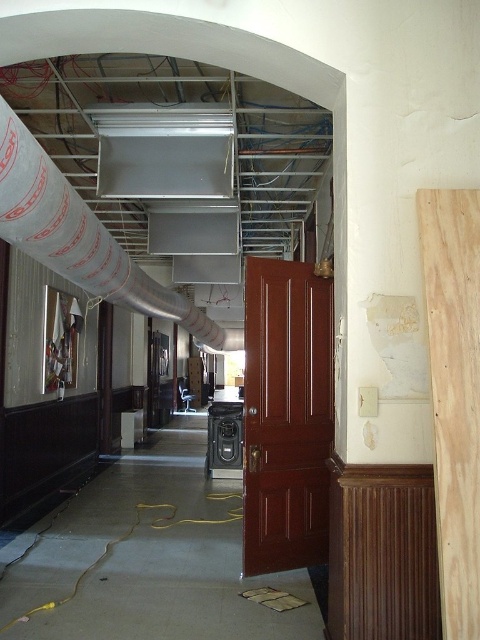
Which is below, yellow rubber hose at center or white plastic pipe at upper left?

yellow rubber hose at center

How distant is yellow rubber hose at center from white plastic pipe at upper left?

8.43 feet

Does point (167, 493) come farther from viewer compared to point (208, 337)?

No, (167, 493) is closer to viewer.

What are the coordinates of `yellow rubber hose at center` in the screenshot? It's located at (147, 557).

Which of these two, mahogany wood door at center or natural wood plank at right, stands taller?

mahogany wood door at center

Can you confirm if mahogany wood door at center is taller than natural wood plank at right?

Indeed, mahogany wood door at center has a greater height compared to natural wood plank at right.

Does point (250, 506) come closer to viewer compared to point (458, 470)?

No, (250, 506) is further to viewer.

Locate an element on the screen. The image size is (480, 640). mahogany wood door at center is located at coordinates (286, 416).

Consider the image. Which is above, yellow rubber hose at center or natural wood plank at right?

natural wood plank at right is higher up.

Who is lower down, yellow rubber hose at center or natural wood plank at right?

yellow rubber hose at center is below.

Does point (222, 552) come closer to viewer compared to point (447, 385)?

No, it is behind (447, 385).

This screenshot has height=640, width=480. Identify the location of yellow rubber hose at center. (147, 557).